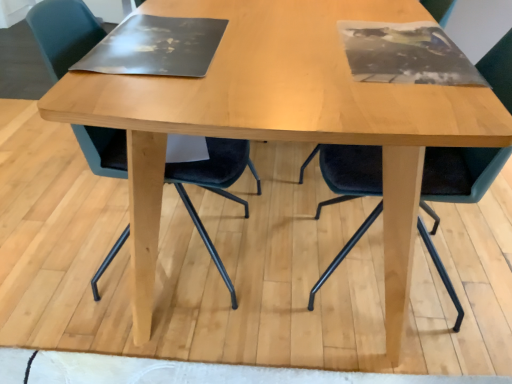
Question: In terms of width, does velvet dark green chair at left, which is the 2th chair in right-to-left order, look wider or thinner when compared to velvet dark blue chair at center, the second chair in the left-to-right sequence?

Choices:
 (A) wide
 (B) thin

Answer: (A)

Question: Considering the relative positions of velvet dark green chair at left, acting as the 1th chair starting from the left, and velvet dark blue chair at center, the second chair in the left-to-right sequence, in the image provided, is velvet dark green chair at left, acting as the 1th chair starting from the left, to the left or to the right of velvet dark blue chair at center, the second chair in the left-to-right sequence,?

Choices:
 (A) right
 (B) left

Answer: (B)

Question: Is velvet dark green chair at left, acting as the 1th chair starting from the left, inside the boundaries of velvet dark blue chair at center, which ranks as the 1th chair in right-to-left order, or outside?

Choices:
 (A) inside
 (B) outside

Answer: (B)

Question: From a real-world perspective, is velvet dark blue chair at center, which ranks as the 1th chair in right-to-left order, physically located above or below velvet dark green chair at left, which is the 2th chair in right-to-left order?

Choices:
 (A) above
 (B) below

Answer: (A)

Question: From the image's perspective, is velvet dark blue chair at center, the second chair in the left-to-right sequence, above or below velvet dark green chair at left, acting as the 1th chair starting from the left?

Choices:
 (A) below
 (B) above

Answer: (A)

Question: Is point (440, 261) positioned closer to the camera than point (216, 256)?

Choices:
 (A) farther
 (B) closer

Answer: (A)

Question: Considering the relative positions of velvet dark blue chair at center, the second chair in the left-to-right sequence, and velvet dark green chair at left, which is the 2th chair in right-to-left order, in the image provided, is velvet dark blue chair at center, the second chair in the left-to-right sequence, to the left or to the right of velvet dark green chair at left, which is the 2th chair in right-to-left order,?

Choices:
 (A) right
 (B) left

Answer: (A)